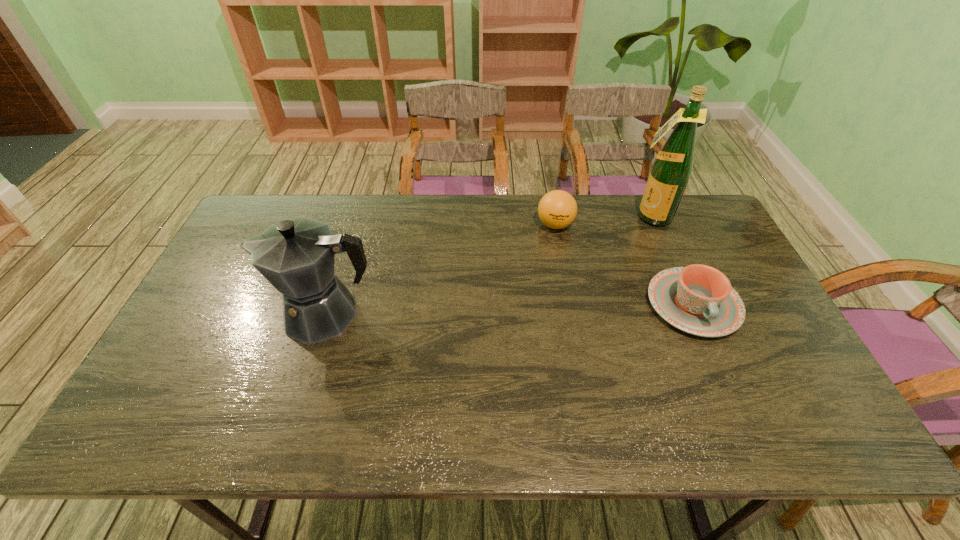
This screenshot has width=960, height=540. Find the location of `coffeepot`. coffeepot is located at coordinates (297, 256).

Where is `the leftmost object`? This screenshot has width=960, height=540. the leftmost object is located at coordinates (297, 256).

The image size is (960, 540). What are the coordinates of `chinaware` in the screenshot? It's located at (697, 299).

You are a GUI agent. You are given a task and a screenshot of the screen. Output one action in this format:
    pyautogui.click(x=<x>, y=<y>)
    Task: Click on the second shortest object
    The width and height of the screenshot is (960, 540).
    Given the screenshot: What is the action you would take?
    pyautogui.click(x=557, y=209)

Where is `ping-pong ball`? ping-pong ball is located at coordinates (557, 209).

This screenshot has height=540, width=960. What are the coordinates of `the tallest object` in the screenshot? It's located at (671, 170).

The image size is (960, 540). What are the coordinates of `vacant area located 0.100m at the spout of the third shortest object` in the screenshot? It's located at (237, 314).

What are the coordinates of `free point located at the spout of the third shortest object` in the screenshot? It's located at (204, 314).

Where is `blank area located 0.170m at the spout of the third shortest object`? The height and width of the screenshot is (540, 960). blank area located 0.170m at the spout of the third shortest object is located at coordinates (212, 314).

I want to click on vacant space located on the side with brand of the third object from right to left, so click(x=535, y=268).